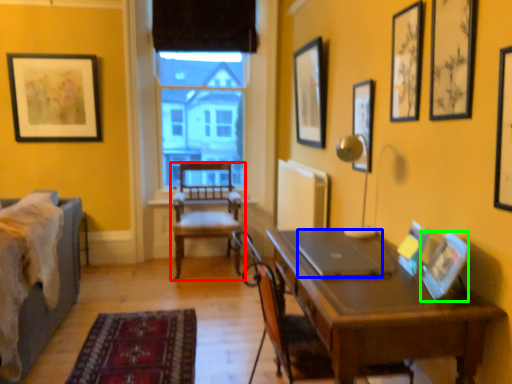
Question: Which object is the closest to the chair (highlighted by a red box)? Choose among these: laptop (highlighted by a blue box) or picture frame (highlighted by a green box).

Choices:
 (A) laptop
 (B) picture frame

Answer: (A)